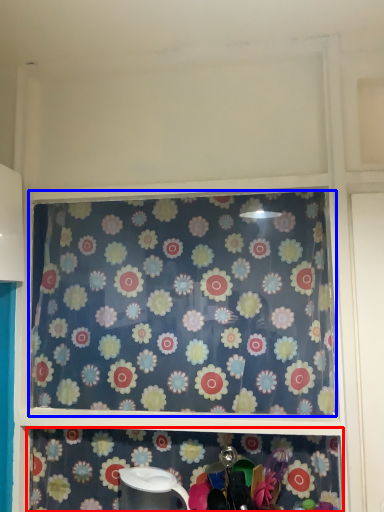
Question: Which object appears closest to the camera in this image, shelf (highlighted by a red box) or curtain (highlighted by a blue box)?

Choices:
 (A) shelf
 (B) curtain

Answer: (A)